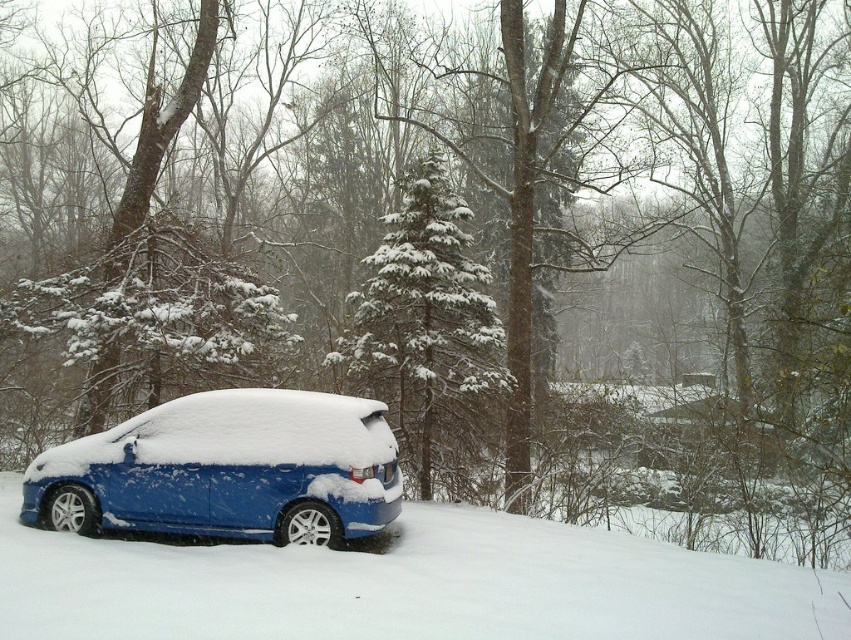
In the scene shown: Who is more forward, (366, 490) or (471, 289)?

Point (366, 490) is more forward.

Is blue metallic hatchback at lower left smaller than snow-covered evergreen tree at center?

Indeed, blue metallic hatchback at lower left has a smaller size compared to snow-covered evergreen tree at center.

Who is more forward, [231,420] or [406,426]?

Point [231,420]

The width and height of the screenshot is (851, 640). In order to click on blue metallic hatchback at lower left in this screenshot , I will do `click(227, 468)`.

Does slick blue car at lower left have a lesser width compared to snow-covered evergreen tree at center?

No.

Is the position of slick blue car at lower left more distant than that of snow-covered evergreen tree at center?

No, it is in front of snow-covered evergreen tree at center.

Is point (521, 573) positioned behind point (381, 385)?

No, it is in front of (381, 385).

Locate an element on the screen. The image size is (851, 640). slick blue car at lower left is located at coordinates (406, 586).

In the scene shown: Which of these two, slick blue car at lower left or blue metallic hatchback at lower left, stands taller?

blue metallic hatchback at lower left

At what (x,y) coordinates should I click in order to perform the action: click on slick blue car at lower left. Please return your answer as a coordinate pair (x, y). Looking at the image, I should click on (406, 586).

Locate an element on the screen. slick blue car at lower left is located at coordinates click(x=406, y=586).